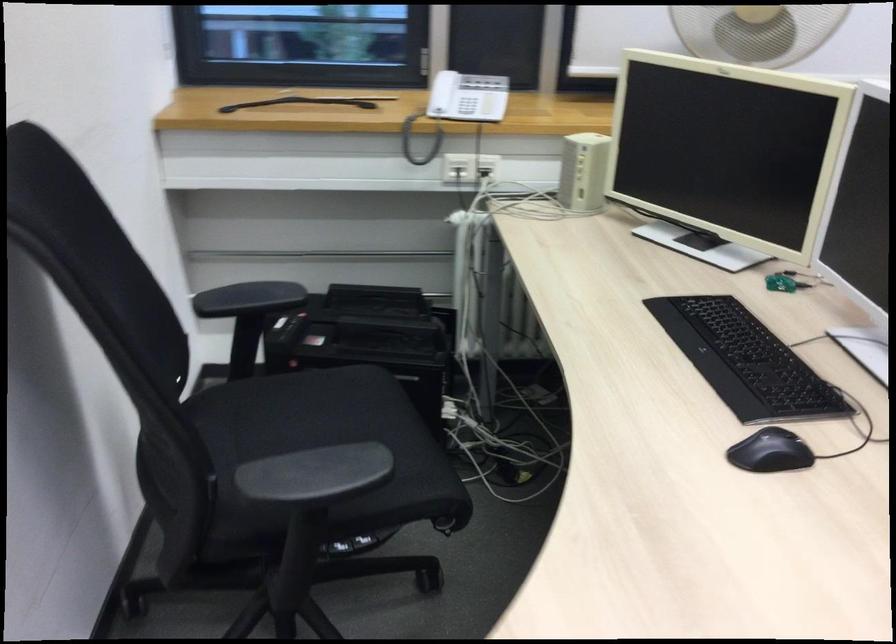
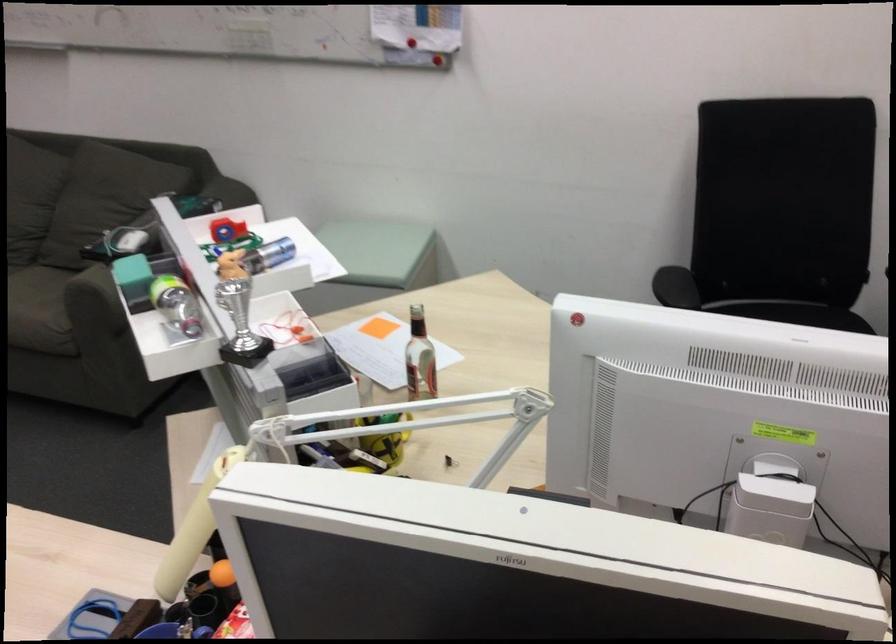
The point at (334, 467) is marked in the first image. Where is the corresponding point in the second image?

(675, 287)